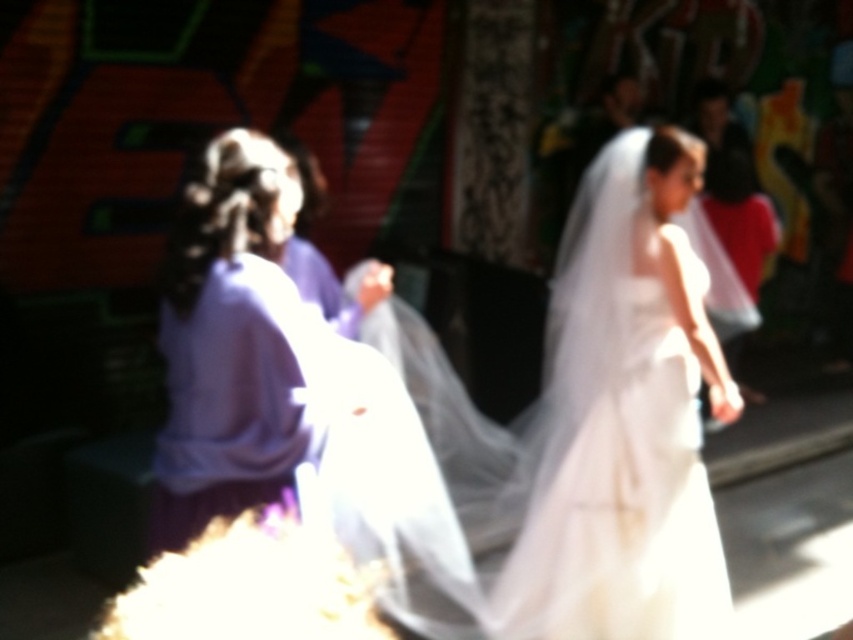
Looking at this image, does white sheer dress at center have a larger size compared to purple satin dress at left?

Yes.

Can you confirm if white sheer dress at center is positioned below purple satin dress at left?

Yes, white sheer dress at center is below purple satin dress at left.

Who is more distant from viewer, [622,429] or [286,216]?

Point [622,429]

Locate an element on the screen. white sheer dress at center is located at coordinates (590, 433).